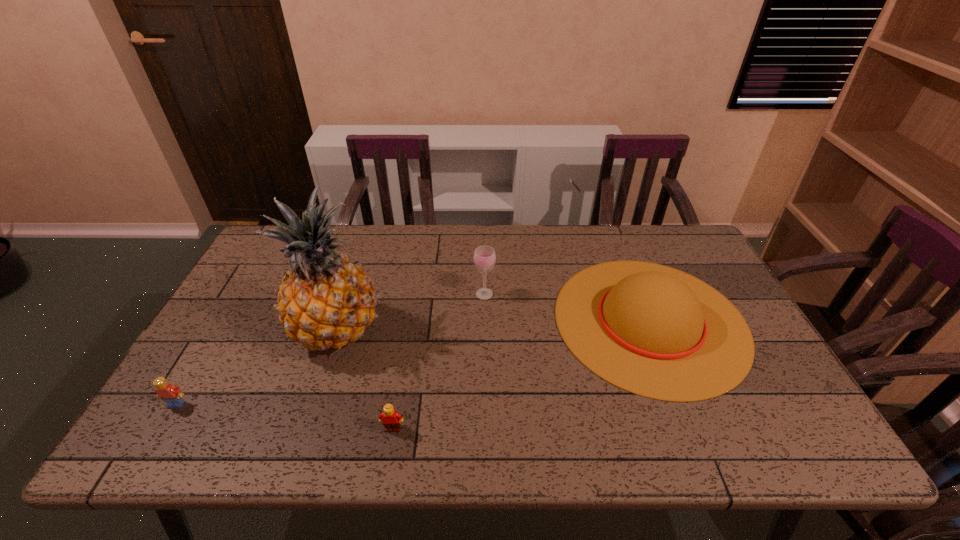
Where is `free space at the right edge`? The height and width of the screenshot is (540, 960). free space at the right edge is located at coordinates (756, 407).

In the image, there is a desktop. Identify the location of vacant region at the far right corner. (664, 245).

In the image, there is a desktop. Where is `free space at the near right corner`? The height and width of the screenshot is (540, 960). free space at the near right corner is located at coordinates (742, 435).

This screenshot has height=540, width=960. I want to click on free space between the left Lego and the rightmost object, so click(413, 362).

Where is `free space between the fourth object from left to right and the pineapple`? The image size is (960, 540). free space between the fourth object from left to right and the pineapple is located at coordinates (412, 313).

Identify the location of free space between the pineapple and the wineglass. [412, 313].

Where is `empty location between the pineapple and the farther Lego`? This screenshot has height=540, width=960. empty location between the pineapple and the farther Lego is located at coordinates (257, 368).

The image size is (960, 540). I want to click on free space between the farther Lego and the sombrero, so click(413, 362).

You are a GUI agent. You are given a task and a screenshot of the screen. Output one action in this format:
    pyautogui.click(x=<x>, y=<y>)
    Task: Click on the vacant point located between the right Lego and the left Lego
    
    Given the screenshot: What is the action you would take?
    pyautogui.click(x=285, y=416)

Locate an element on the screen. This screenshot has height=540, width=960. free space that is in between the leftmost object and the wineglass is located at coordinates (330, 349).